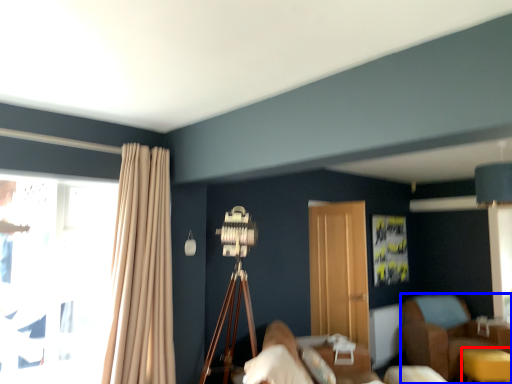
Question: Which point is further to the camera, table (highlighted by a red box) or furniture (highlighted by a blue box)?

Choices:
 (A) table
 (B) furniture

Answer: (B)